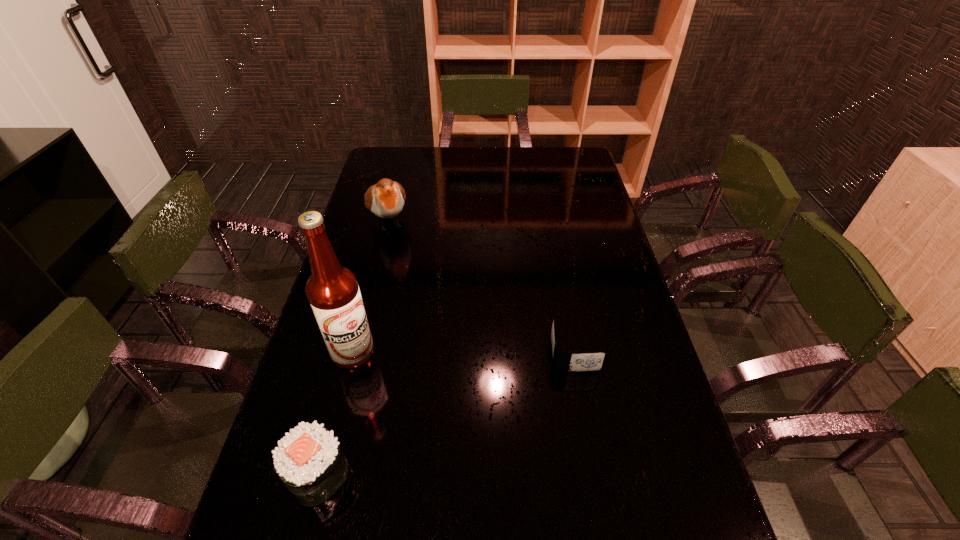
Identify the location of free point between the tallest object and the third tallest object. Image resolution: width=960 pixels, height=540 pixels. (335, 413).

What are the coordinates of `free space that is in between the wallet and the farthest object` in the screenshot? It's located at (481, 288).

Find the location of `free point between the third tallest object and the alcohol`. free point between the third tallest object and the alcohol is located at coordinates (335, 413).

Identify the location of unoccupied area between the wallet and the alcohol. (464, 353).

The image size is (960, 540). I want to click on free space between the bird and the rightmost object, so click(x=481, y=288).

Identify the location of unoccupied area between the bird and the shortest object. (481, 288).

Where is `empty space that is in between the farthest object and the alcohol`? empty space that is in between the farthest object and the alcohol is located at coordinates (371, 286).

Select which object is the second closest to the alcohol. Please provide its 2D coordinates. Your answer should be formatted as a tuple, i.e. [(x, y)], where the tuple contains the x and y coordinates of a point satisfying the conditions above.

[(385, 199)]

I want to click on object that stands as the third closest to the third shortest object, so click(309, 460).

Identify the location of free spot that satisfies the following two spatial constraints: 1. on the front side of the farthest object; 2. on the outer surface of the wallet. (356, 354).